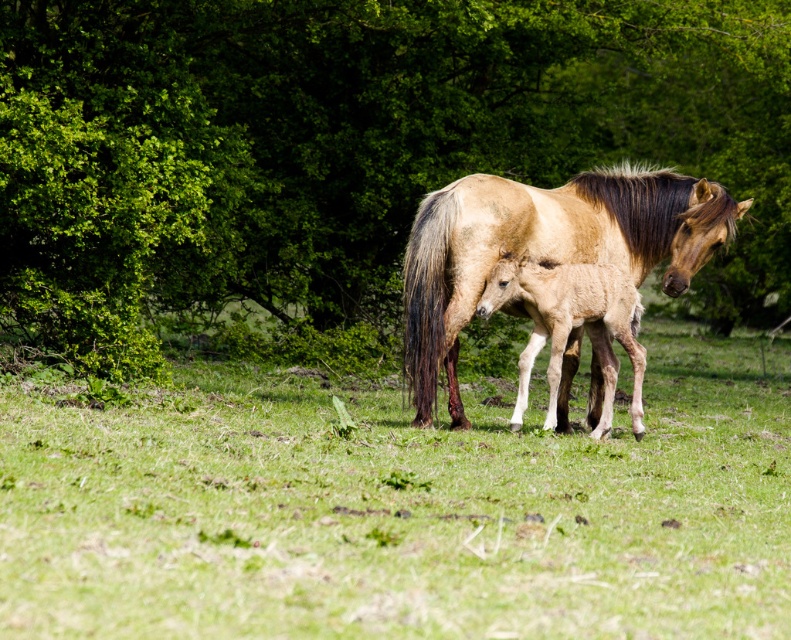
Question: Among these points, which one is farthest from the camera?

Choices:
 (A) (536, 404)
 (B) (578, 220)

Answer: (A)

Question: Is green leafy tree at center above green grassy at center?

Choices:
 (A) no
 (B) yes

Answer: (B)

Question: Among these points, which one is farthest from the camera?

Choices:
 (A) (477, 237)
 (B) (649, 342)

Answer: (B)

Question: Can you confirm if green leafy tree at center is positioned above green grassy at center?

Choices:
 (A) no
 (B) yes

Answer: (B)

Question: Can you confirm if green leafy tree at center is positioned above light brown glossy horse at center?

Choices:
 (A) no
 (B) yes

Answer: (B)

Question: Which point is closer to the camera?

Choices:
 (A) (57, 68)
 (B) (127, 598)

Answer: (B)